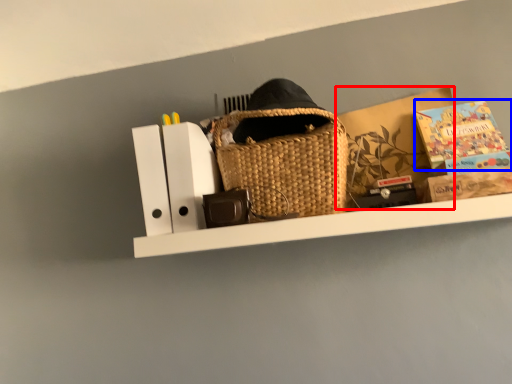
Question: Which of the following is the farthest to the observer, cardboard box (highlighted by a red box) or paperback book (highlighted by a blue box)?

Choices:
 (A) cardboard box
 (B) paperback book

Answer: (A)